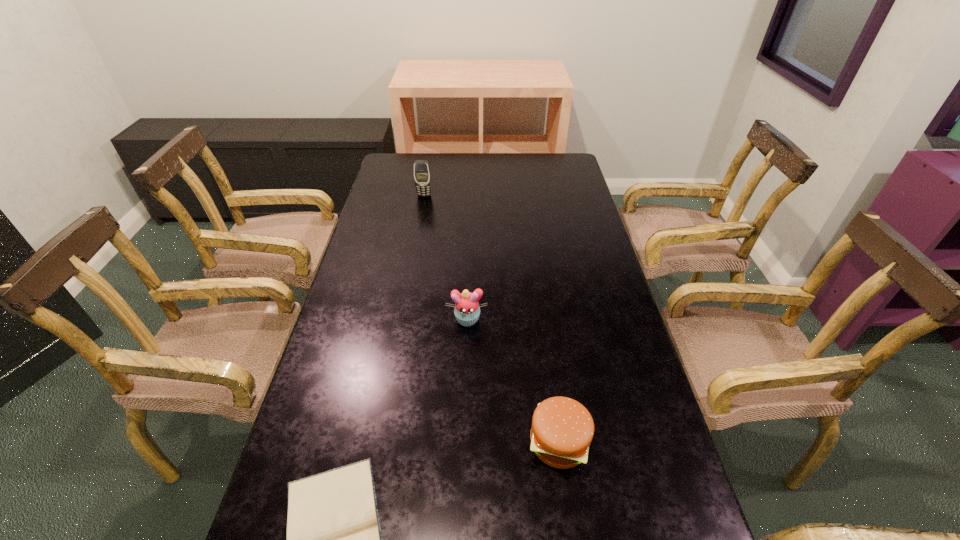
Find the location of a particular element. This screenshot has width=960, height=540. the tallest object is located at coordinates (422, 176).

You are a GUI agent. You are given a task and a screenshot of the screen. Output one action in this format:
    pyautogui.click(x=<x>, y=<y>)
    Task: Click on the farthest object
    The width and height of the screenshot is (960, 540).
    Given the screenshot: What is the action you would take?
    pyautogui.click(x=422, y=176)

Locate an element on the screen. This screenshot has height=540, width=960. the second tallest object is located at coordinates (467, 311).

In order to click on the third nearest object in this screenshot , I will do `click(467, 311)`.

Where is `the third tallest object`? This screenshot has width=960, height=540. the third tallest object is located at coordinates (562, 429).

Find the location of `hamburger`. hamburger is located at coordinates (562, 429).

The image size is (960, 540). I want to click on vacant space located on the front face of the farthest object, so click(414, 254).

Locate an element on the screen. The image size is (960, 540). free region located on the face of the cupcake is located at coordinates (463, 460).

Find the location of a particular element. This screenshot has width=960, height=540. free location located 0.110m on the right of the third tallest object is located at coordinates (640, 442).

Locate an element on the screen. object situated at the left edge is located at coordinates (422, 176).